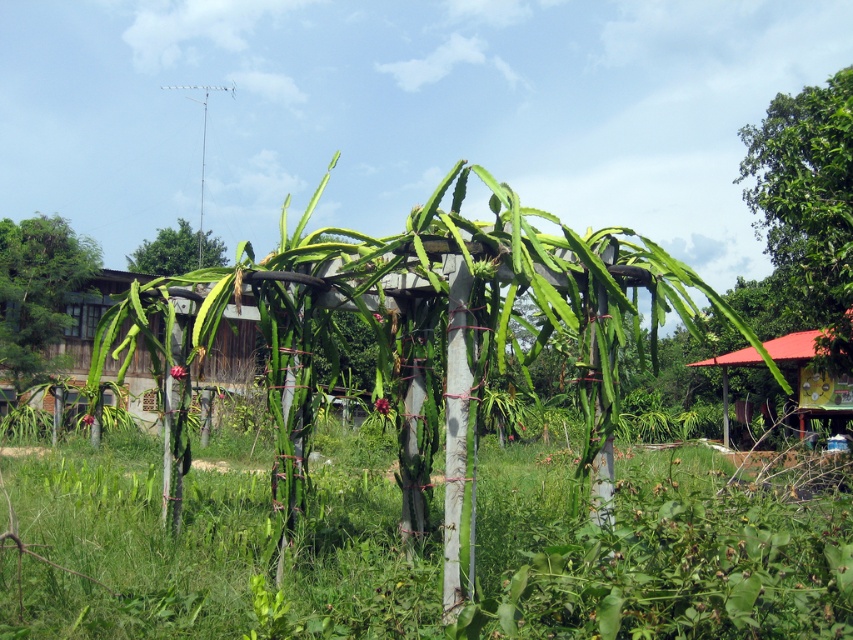
Which is behind, point (239, 477) or point (822, 129)?

The point (822, 129) is behind.

Who is positioned more to the right, green leafy grass at center or green leafy tree at upper right?

green leafy tree at upper right is more to the right.

Is point (840, 493) positioned behind point (805, 113)?

No, (840, 493) is in front of (805, 113).

The width and height of the screenshot is (853, 640). Find the location of `green leafy grass at center`. green leafy grass at center is located at coordinates (207, 545).

Can you confirm if green leafy plant at center is thinner than green leafy tree at upper right?

Correct, green leafy plant at center's width is less than green leafy tree at upper right's.

Can you confirm if green leafy plant at center is positioned to the left of green leafy tree at upper right?

Yes, green leafy plant at center is to the left of green leafy tree at upper right.

Measure the distance between green leafy plant at center and camera.

14.98 feet

Where is `green leafy plant at center`? Image resolution: width=853 pixels, height=640 pixels. green leafy plant at center is located at coordinates (x=430, y=333).

Does point (277, 621) lie in front of point (821, 387)?

Yes, point (277, 621) is closer to viewer.

Can you confirm if green leafy grass at center is positioned above red corrugated metal hut at center right?

No.

Where is `green leafy grass at center`? green leafy grass at center is located at coordinates (207, 545).